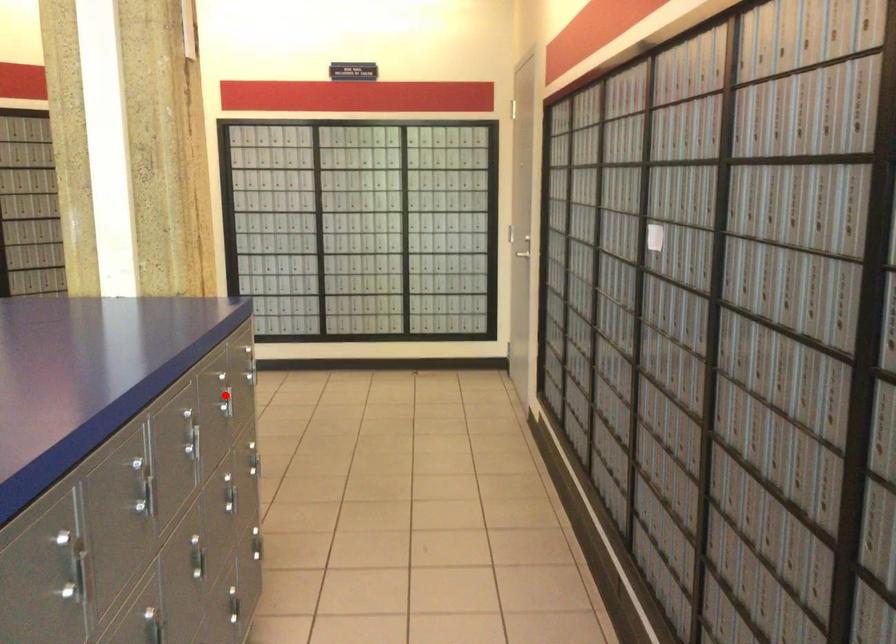
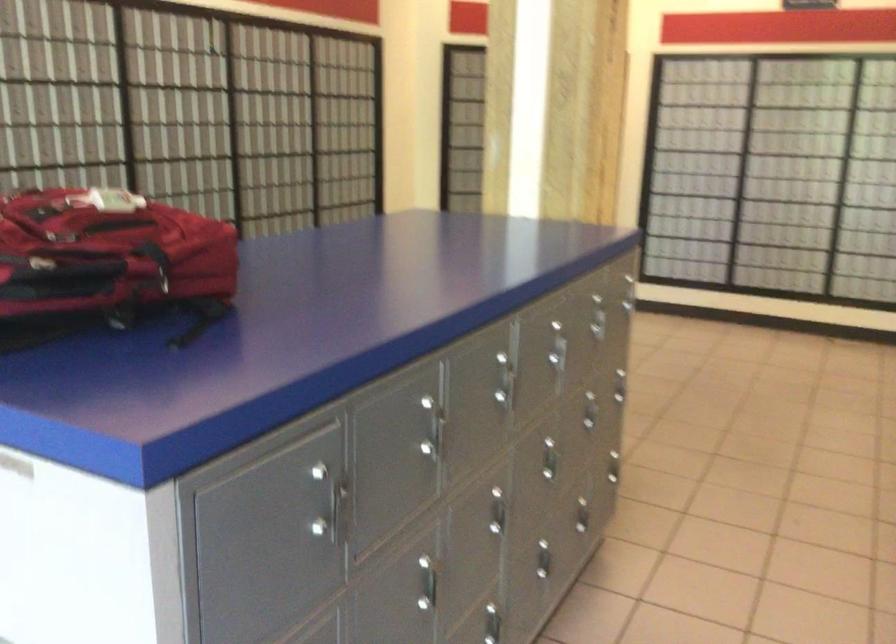
Question: I am providing you with two images of the same scene from different viewpoints. A red point is marked on the first image. At the location where the point appears in image 1, is it still visible in image 2?

Choices:
 (A) Yes
 (B) No

Answer: (A)